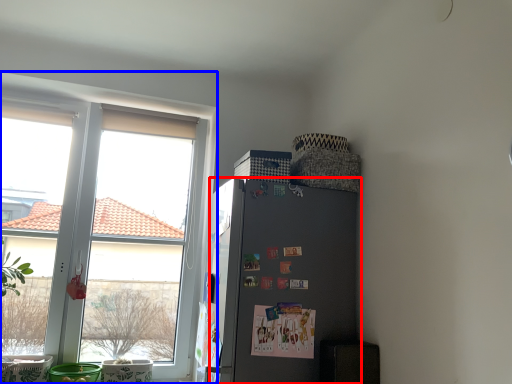
Question: Which of the following is the farthest to the observer, refrigerator (highlighted by a red box) or window (highlighted by a blue box)?

Choices:
 (A) refrigerator
 (B) window

Answer: (B)